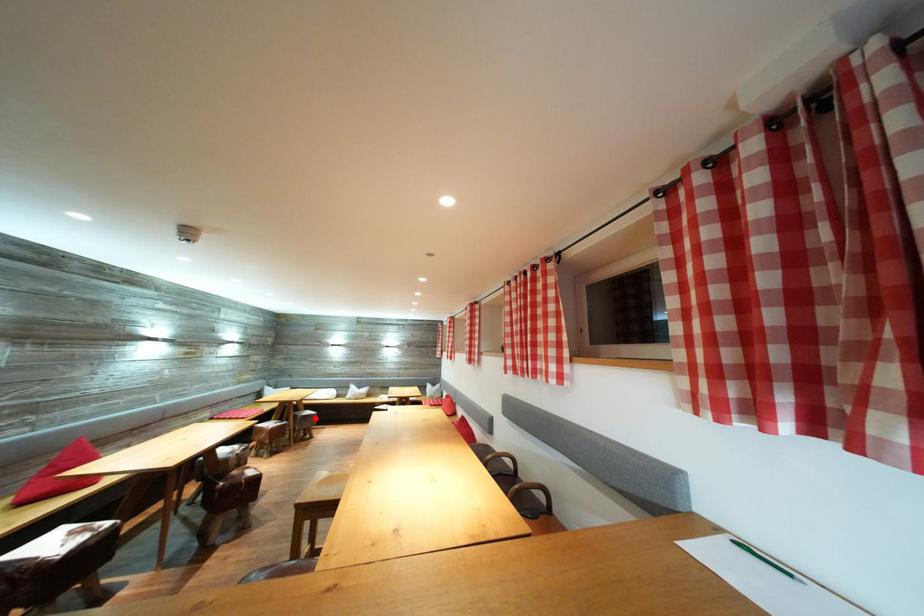
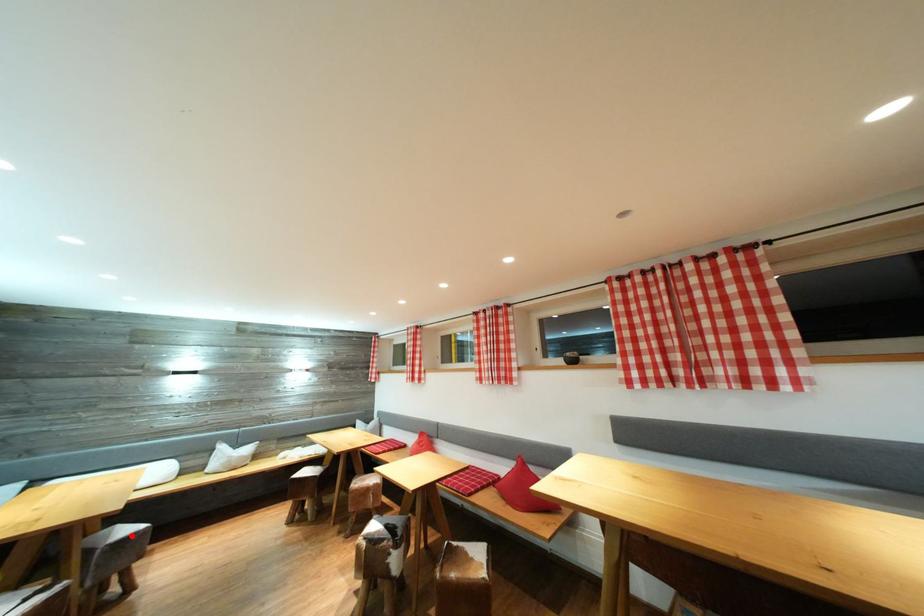
I am providing you with two images of the same scene from different viewpoints. A red point is marked on the first image and another point is marked on the second image. Is the red point in image1 aligned with the point shown in image2?

Yes